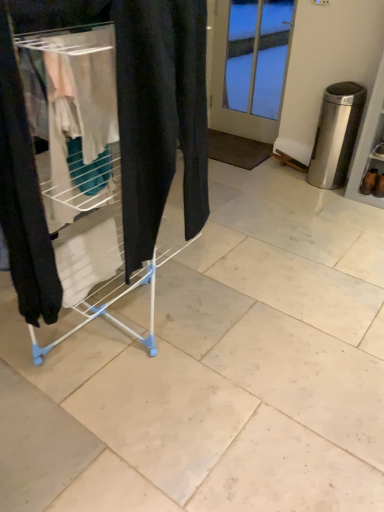
Question: Is the depth of white plastic drying rack at left less than that of satin silver trash can at right?

Choices:
 (A) yes
 (B) no

Answer: (A)

Question: From the image's perspective, is white plastic drying rack at left below satin silver trash can at right?

Choices:
 (A) yes
 (B) no

Answer: (A)

Question: Is white plastic drying rack at left to the left of satin silver trash can at right from the viewer's perspective?

Choices:
 (A) no
 (B) yes

Answer: (B)

Question: Considering the relative sizes of white plastic drying rack at left and satin silver trash can at right in the image provided, is white plastic drying rack at left bigger than satin silver trash can at right?

Choices:
 (A) yes
 (B) no

Answer: (A)

Question: Is white plastic drying rack at left to the right of satin silver trash can at right from the viewer's perspective?

Choices:
 (A) no
 (B) yes

Answer: (A)

Question: From a real-world perspective, does white plastic drying rack at left stand above satin silver trash can at right?

Choices:
 (A) yes
 (B) no

Answer: (A)

Question: From the image's perspective, is brown suede boot at lower right, the second footwear positioned from the left, located beneath white plastic drying rack at left?

Choices:
 (A) yes
 (B) no

Answer: (B)

Question: Is brown suede boot at lower right, the 1th footwear viewed from the right, closer to the viewer compared to white plastic drying rack at left?

Choices:
 (A) yes
 (B) no

Answer: (B)

Question: Can you confirm if brown suede boot at lower right, the 1th footwear viewed from the right, is thinner than white plastic drying rack at left?

Choices:
 (A) yes
 (B) no

Answer: (A)

Question: Does brown suede boot at lower right, the second footwear positioned from the left, have a greater height compared to white plastic drying rack at left?

Choices:
 (A) yes
 (B) no

Answer: (B)

Question: Is brown suede boot at lower right, the 1th footwear viewed from the right, shorter than white plastic drying rack at left?

Choices:
 (A) no
 (B) yes

Answer: (B)

Question: Would you say brown suede boot at lower right, the second footwear positioned from the left, is outside white plastic drying rack at left?

Choices:
 (A) no
 (B) yes

Answer: (B)

Question: From the image's perspective, is brown suede boot at lower right, the second footwear positioned from the left, located above satin silver trash can at right?

Choices:
 (A) no
 (B) yes

Answer: (A)